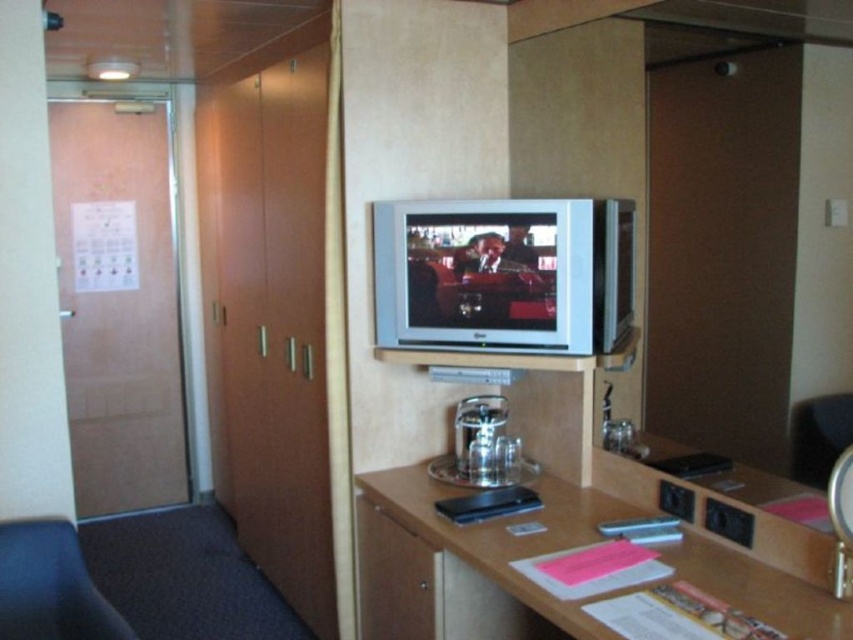
Is wooden desk at center above matte wood drawer at center?

Indeed, wooden desk at center is positioned over matte wood drawer at center.

Measure the distance between wooden desk at center and camera.

1.42 meters

This screenshot has width=853, height=640. I want to click on wooden desk at center, so click(477, 556).

Is point (38, 582) positioned after point (369, 525)?

No, it is not.

Which is below, black leather swivel chair at lower left or matte wood drawer at center?

matte wood drawer at center is lower down.

Is point (44, 540) in front of point (379, 540)?

Yes, it is in front of point (379, 540).

Find the location of `black leather swivel chair at lower left`. black leather swivel chair at lower left is located at coordinates (50, 586).

Does point (572, 298) come farther from viewer compared to point (96, 612)?

Yes, point (572, 298) is behind point (96, 612).

Is silver metallic flat screen tv at center above black leather swivel chair at lower left?

Yes, silver metallic flat screen tv at center is above black leather swivel chair at lower left.

Is point (630, 253) farther from viewer compared to point (56, 531)?

Yes.

At what (x,y) coordinates should I click in order to perform the action: click on silver metallic flat screen tv at center. Please return your answer as a coordinate pair (x, y). This screenshot has width=853, height=640. Looking at the image, I should click on (503, 275).